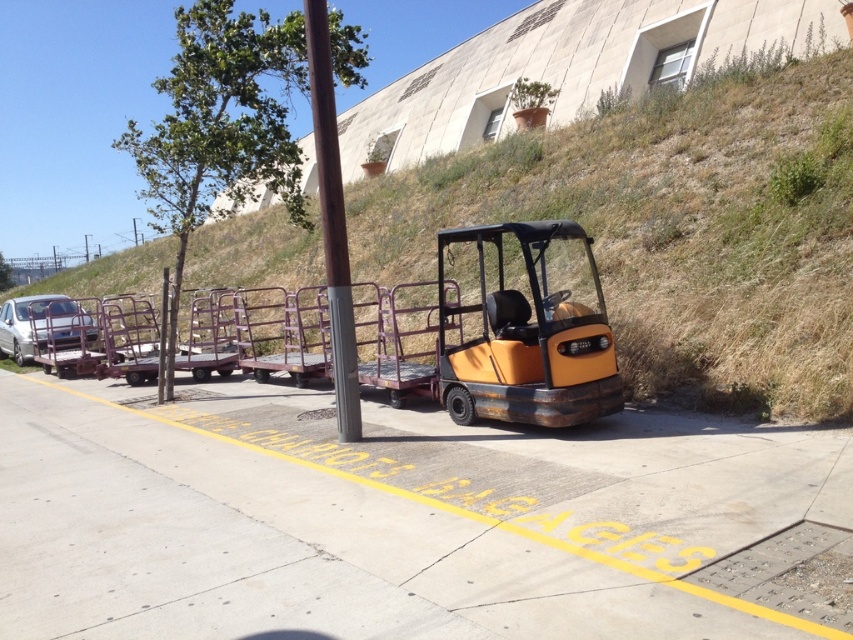
Question: Among these points, which one is nearest to the camera?

Choices:
 (A) click(595, 200)
 (B) click(439, 376)

Answer: (B)

Question: Can you confirm if orange metallic forklift at center is thinner than silver metallic car at left?

Choices:
 (A) no
 (B) yes

Answer: (A)

Question: Is the position of orange matte forklift at center less distant than that of silver metallic car at left?

Choices:
 (A) no
 (B) yes

Answer: (B)

Question: Is orange metallic forklift at center behind brown wood pole at center?

Choices:
 (A) no
 (B) yes

Answer: (A)

Question: Which object is the closest to the orange matte forklift at center?

Choices:
 (A) orange metallic forklift at center
 (B) brown wood pole at center
 (C) silver metallic car at left

Answer: (B)

Question: Which point appears closest to the camera in this image?

Choices:
 (A) (335, 316)
 (B) (614, 371)

Answer: (A)